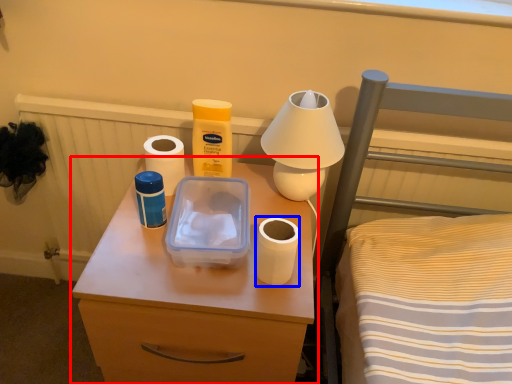
Question: Which object is closer to the camera taking this photo, nightstand (highlighted by a red box) or toilet paper (highlighted by a blue box)?

Choices:
 (A) nightstand
 (B) toilet paper

Answer: (A)